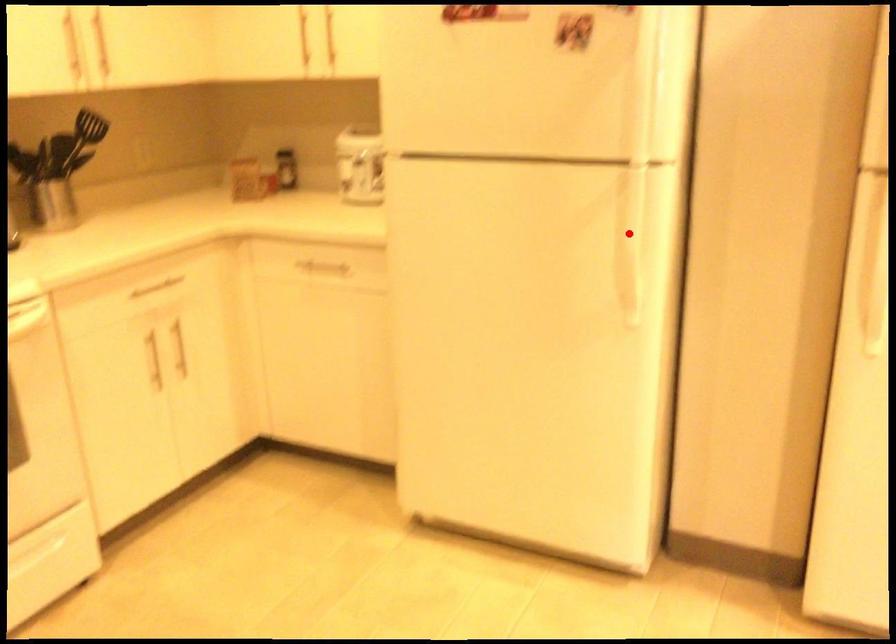
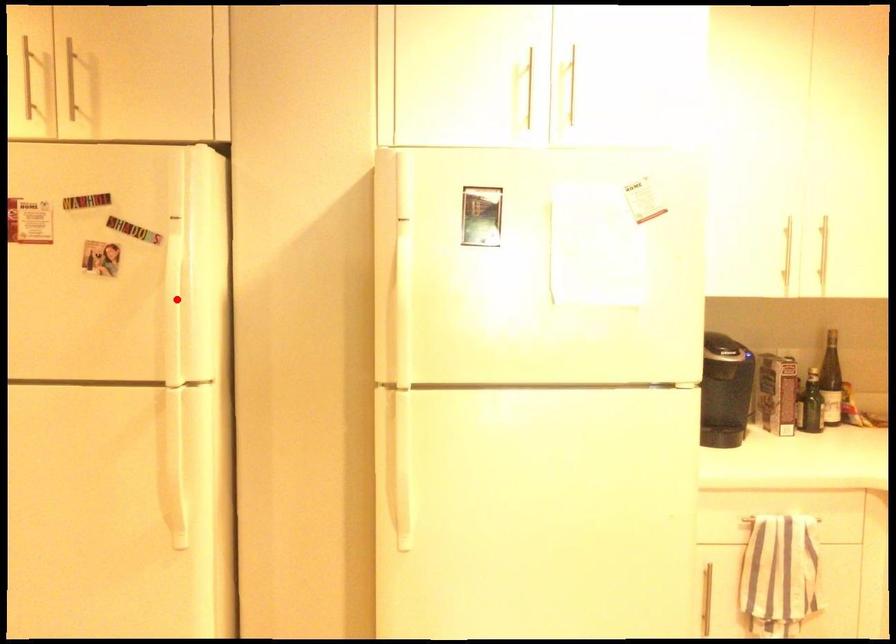
Consider the image. I am providing you with two images of the same scene from different viewpoints. A red point is marked on the first image and another point is marked on the second image. Are the points marked in image1 and image2 representing the same 3D position?

No